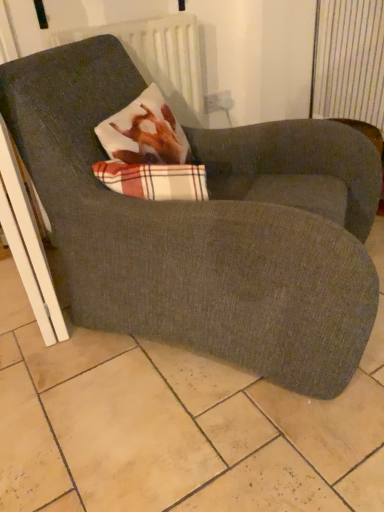
Question: Would you say dark gray fabric chair at center is outside white textured radiator at upper center?

Choices:
 (A) no
 (B) yes

Answer: (B)

Question: Is dark gray fabric chair at center to the right of white textured radiator at upper center from the viewer's perspective?

Choices:
 (A) no
 (B) yes

Answer: (B)

Question: Does dark gray fabric chair at center have a greater height compared to white textured radiator at upper center?

Choices:
 (A) yes
 (B) no

Answer: (A)

Question: From the image's perspective, is dark gray fabric chair at center located above white textured radiator at upper center?

Choices:
 (A) yes
 (B) no

Answer: (B)

Question: Is dark gray fabric chair at center wider than white textured radiator at upper center?

Choices:
 (A) yes
 (B) no

Answer: (A)

Question: From a real-world perspective, does dark gray fabric chair at center stand above white textured radiator at upper center?

Choices:
 (A) yes
 (B) no

Answer: (B)

Question: Is white textured radiator at upper center at the left side of dark gray fabric chair at center?

Choices:
 (A) yes
 (B) no

Answer: (A)

Question: Is white textured radiator at upper center shorter than dark gray fabric chair at center?

Choices:
 (A) no
 (B) yes

Answer: (B)

Question: From the image's perspective, is white textured radiator at upper center beneath dark gray fabric chair at center?

Choices:
 (A) no
 (B) yes

Answer: (A)

Question: Considering the relative sizes of white textured radiator at upper center and dark gray fabric chair at center in the image provided, is white textured radiator at upper center bigger than dark gray fabric chair at center?

Choices:
 (A) yes
 (B) no

Answer: (B)

Question: Is white textured radiator at upper center surrounding dark gray fabric chair at center?

Choices:
 (A) no
 (B) yes

Answer: (A)

Question: Is white textured radiator at upper center positioned before dark gray fabric chair at center?

Choices:
 (A) yes
 (B) no

Answer: (B)

Question: Is white textured radiator at upper center situated inside dark gray fabric chair at center or outside?

Choices:
 (A) inside
 (B) outside

Answer: (B)